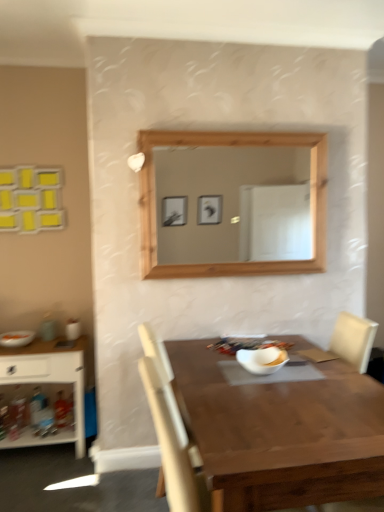
Locate an element on the screen. free space above wooden table at center (from a real-world perspective) is located at coordinates (282, 389).